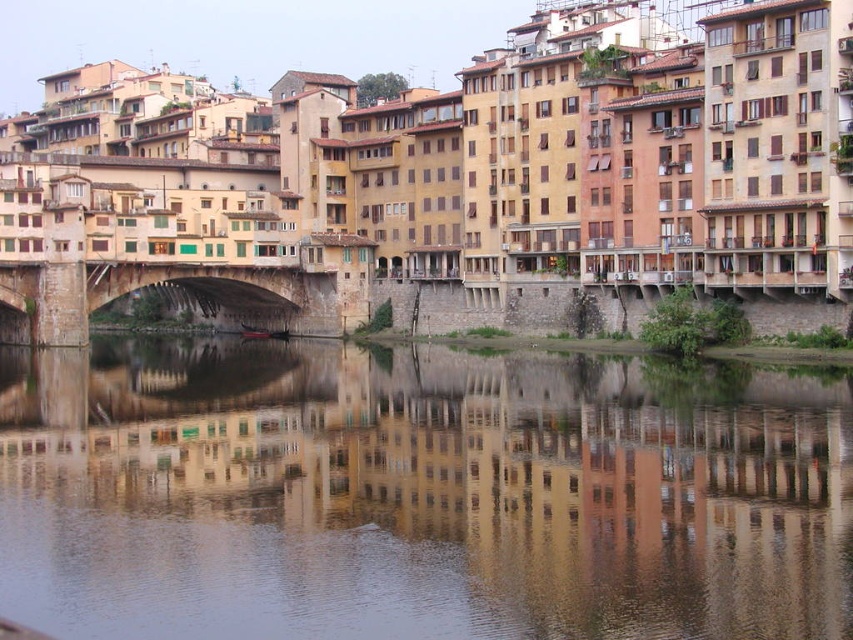
You are a tour guide leading a group along the riverside path. You want to point out both the smooth water at center and the stone arch bridge at center to your group. Since you can only point in one direction, which object is further away from you?

The smooth water at center and the stone arch bridge at center are 36.44 meters apart. Since both are at the center of the image, they are positioned at the same distance from the viewer. Therefore, neither is further away than the other.

You are standing at the point with coordinates (419,493) in the historic riverside town. What type of surface are you currently standing on?

You are standing on smooth water at center located at point (419,493).